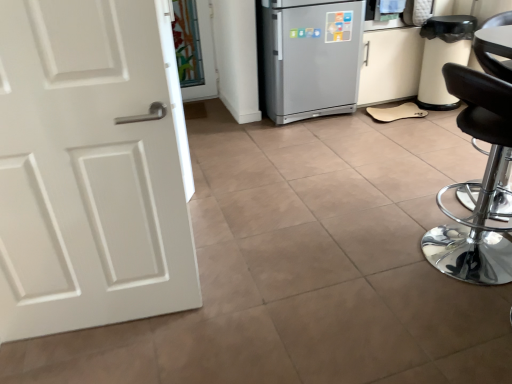
Question: Is black leather stool at right in front of or behind transparent glass door at upper center in the image?

Choices:
 (A) behind
 (B) front

Answer: (B)

Question: Considering the relative positions of black leather stool at right and transparent glass door at upper center in the image provided, is black leather stool at right to the left or to the right of transparent glass door at upper center?

Choices:
 (A) right
 (B) left

Answer: (A)

Question: Which of these objects is positioned farthest from the black leather stool at right?

Choices:
 (A) silver metallic refrigerator at center
 (B) white matte cabinet at right
 (C) transparent glass door at upper center

Answer: (C)

Question: Which object is the farthest from the transparent glass door at upper center?

Choices:
 (A) black leather stool at right
 (B) silver metallic refrigerator at center
 (C) white matte cabinet at right

Answer: (A)